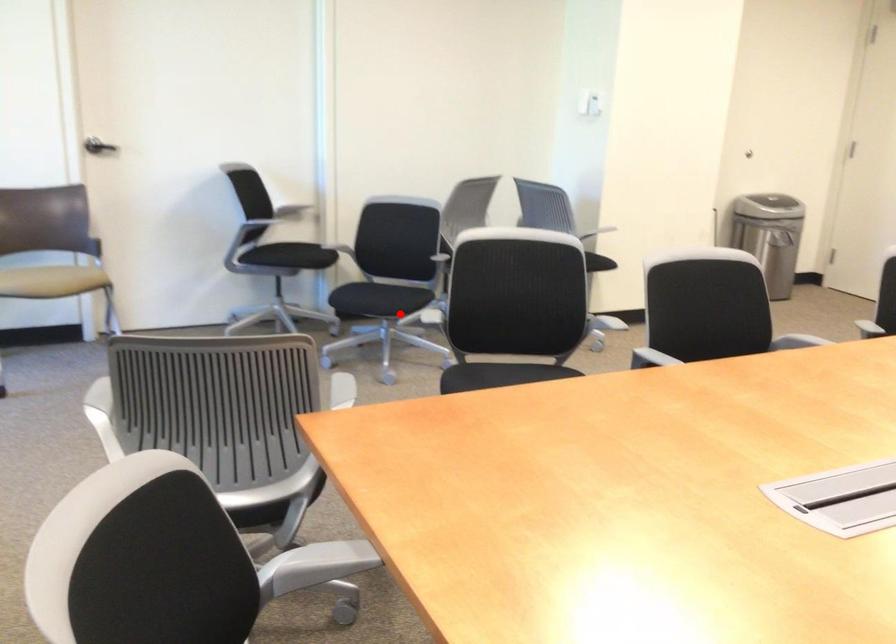
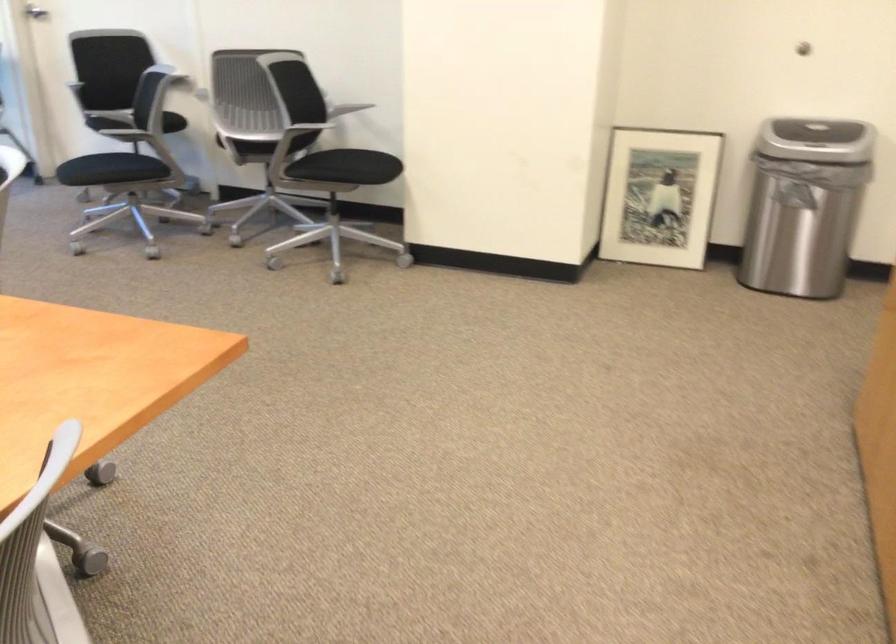
Locate, in the second image, the point that corresponds to the highlighted location in the first image.

(112, 171)